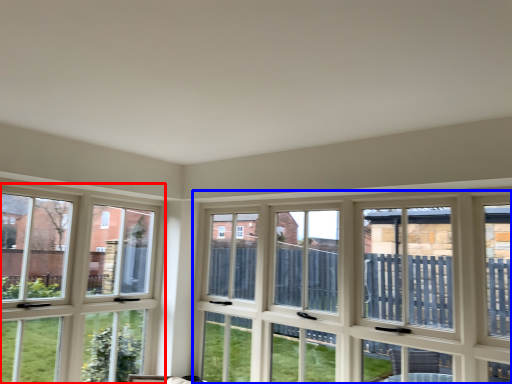
Question: Which object appears closest to the camera in this image, window (highlighted by a red box) or window (highlighted by a blue box)?

Choices:
 (A) window
 (B) window

Answer: (B)